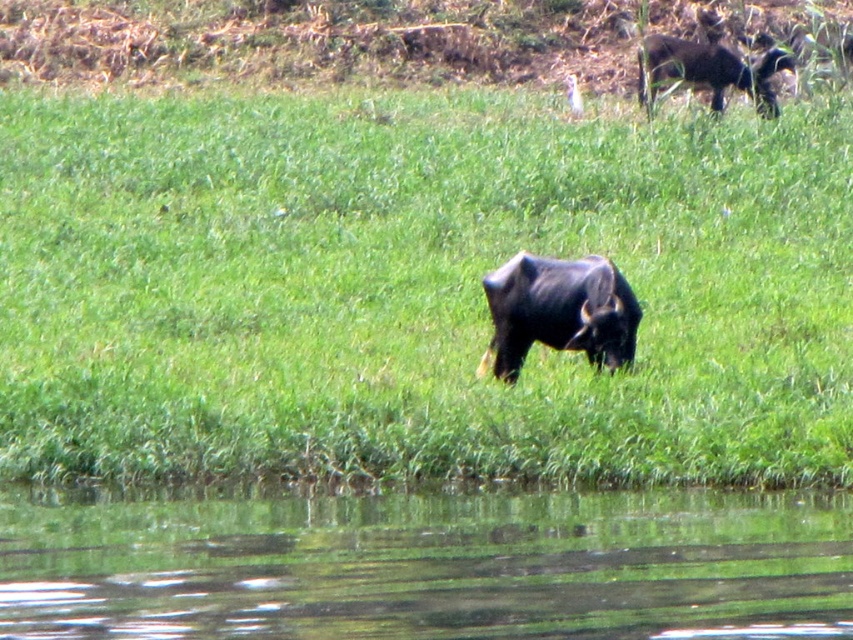
You are standing at the point marked as point (415, 289). Looking around, you see a calm body of water in the foreground and two water buffaloes in the field. Which direction should you walk to reach the water?

Since point (415, 289) is on the green grass at center, you should walk forward towards the calm body of water in the foreground to reach the water.

Based on the photo, you are a photographer trying to capture both the green grassy river at lower center and the black glossy yak at center in a single frame. Based on their sizes in the image, which one will occupy more of the horizontal space in your photo?

The green grassy river at lower center will occupy more horizontal space in the photo since its width is larger than that of the black glossy yak at center.